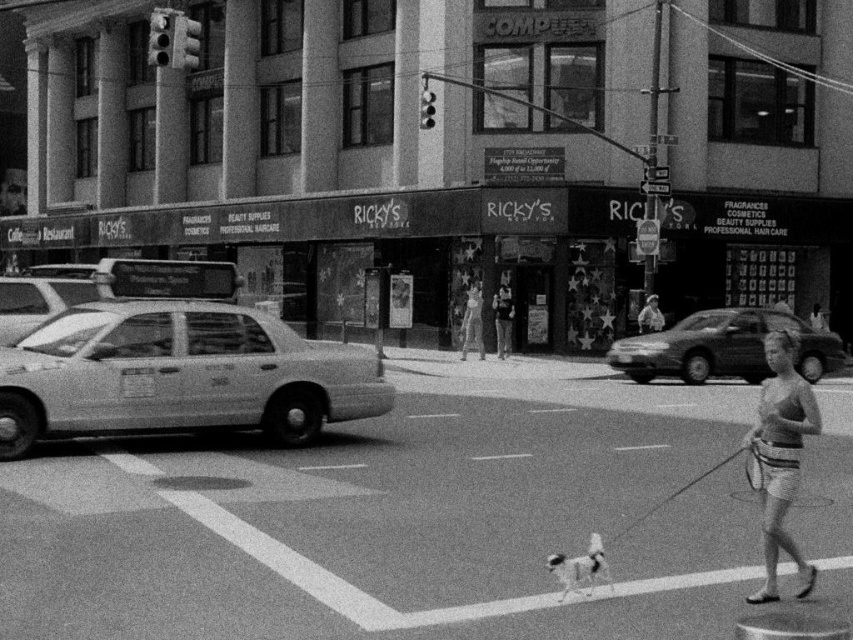
Question: Is the position of metallic gray sedan at center more distant than that of smooth skin person at center?

Choices:
 (A) no
 (B) yes

Answer: (A)

Question: Which of the following is the closest to the observer?

Choices:
 (A) smooth skin person at center
 (B) white glossy taxi cab at left
 (C) matte black tank top at center
 (D) metallic gray sedan at center

Answer: (B)

Question: Can you confirm if matte white taxi at left is bigger than metallic gray sedan at center?

Choices:
 (A) yes
 (B) no

Answer: (B)

Question: Which point is closer to the camera?

Choices:
 (A) (566, 570)
 (B) (67, 305)

Answer: (A)

Question: Estimate the real-world distances between objects in this image. Which object is closer to the white glossy taxi cab at left?

Choices:
 (A) matte black tank top at center
 (B) matte white taxi at left

Answer: (B)

Question: Can you confirm if metallic gray sedan at center is positioned below white glossy taxi cab at left?

Choices:
 (A) yes
 (B) no

Answer: (A)